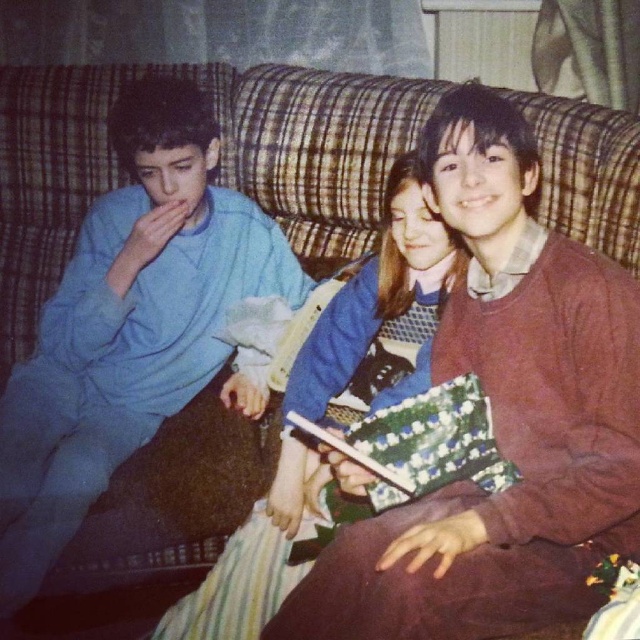
You are trying to decide which sweater to take from the couch where both the matte blue sweater at left and the blue knit sweater at center are placed. Based on their sizes, which one would you choose if you prefer a larger size?

The matte blue sweater at left is larger in size compared to the blue knit sweater at center, so you should choose the matte blue sweater at left if you prefer a larger size.

Looking at this image, you are trying to decide which sweater to wear for a casual event. Both the matte blue sweater at left and the blue knit sweater at center are options. Based on their positions in the image, which one is higher up?

The matte blue sweater at left is positioned above the blue knit sweater at center, so it is higher up in the image.

You are standing at the camera position and want to pick up the matte blue sweater at left. Is the distance between you and the sweater sufficient to stretch your arm and reach it without moving your feet?

The distance between the matte blue sweater at left and the camera is 1.47 meters. Since the average human arm length is about 0.7 meters, you would not be able to reach the sweater without moving your feet.